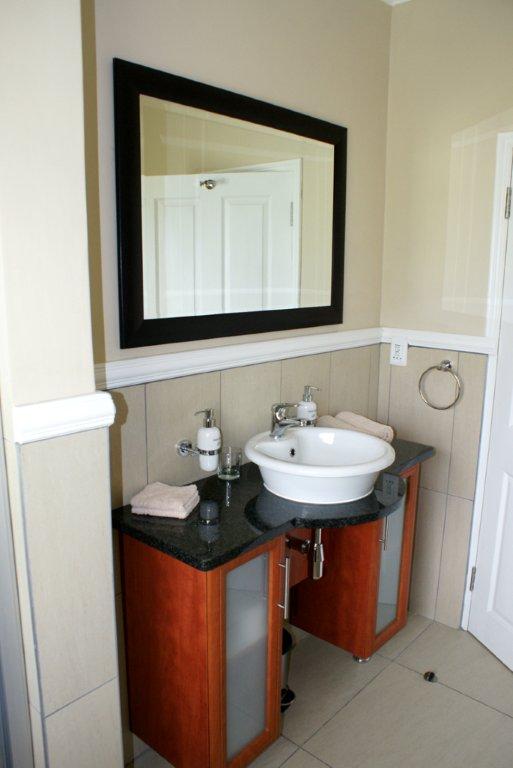
Locate an element on the screen. This screenshot has width=513, height=768. door is located at coordinates (499, 610).